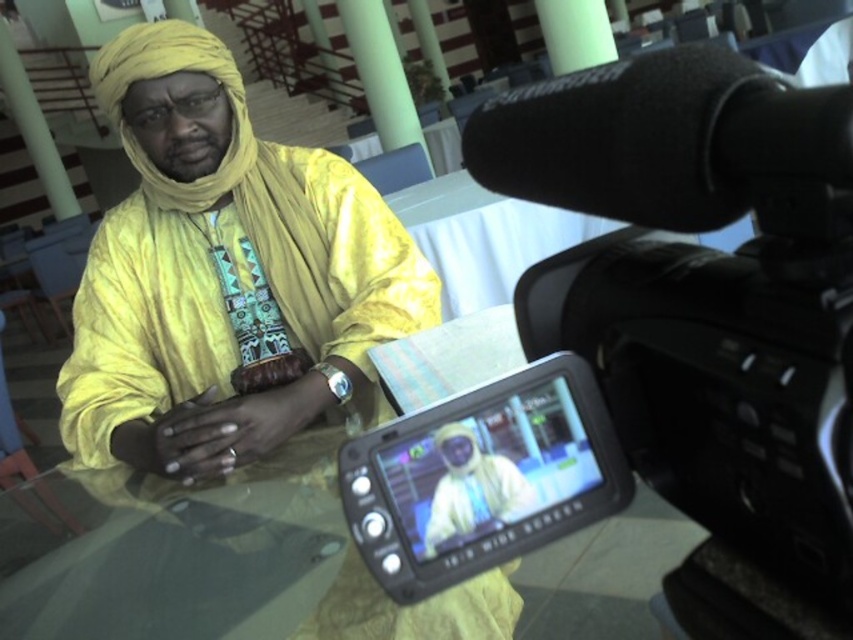
Based on the photo, you are a camera operator trying to adjust your position to get a better angle of the man seated at the transparent glass table at center. Which direction should you move the black plastic video camera at upper right to frame him better?

The black plastic video camera at upper right is positioned on the right side of transparent glass table at center. To frame the man better, you should move the black plastic video camera at upper right to the left side of the transparent glass table at center.

You are a camera operator trying to film the man seated at the transparent glass table at center. The black plastic video camera at upper right is your only camera. Can you film him without any obstruction from the camera itself?

The black plastic video camera at upper right is positioned over transparent glass table at center, so the camera is above the table. This means you can film the man seated at the transparent glass table at center without obstruction from the camera itself.

You are a camera operator adjusting the camera angle to focus on the matte yellow fabric at center and the transparent glass table at center. Which object should you move the camera closer to if you want to capture both objects in the frame without moving the camera position?

The matte yellow fabric at center is positioned on the right side of transparent glass table at center. To capture both in the frame without moving the camera, you should move the camera closer to the transparent glass table at center since the matte yellow fabric at center is already to its right and adjusting focus on the table would naturally include the fabric in the frame.